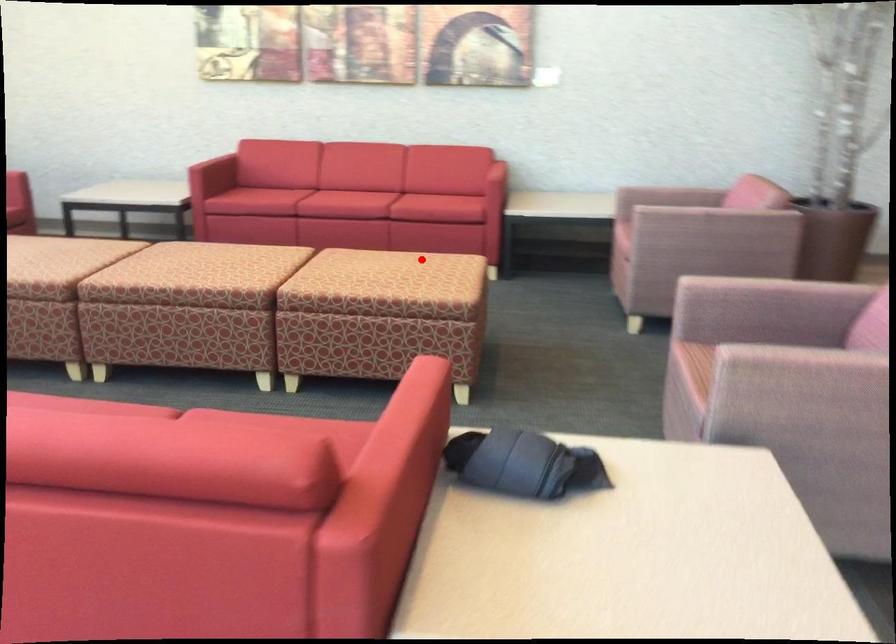
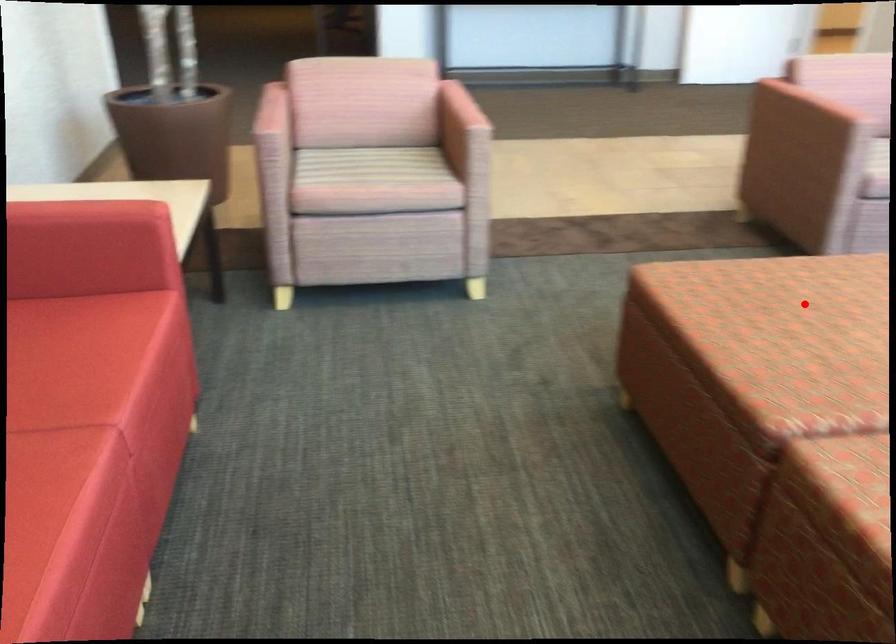
I am providing you with two images of the same scene from different viewpoints. A red point is marked on the first image and another point is marked on the second image. Is the marked point in image1 the same physical position as the marked point in image2?

Yes